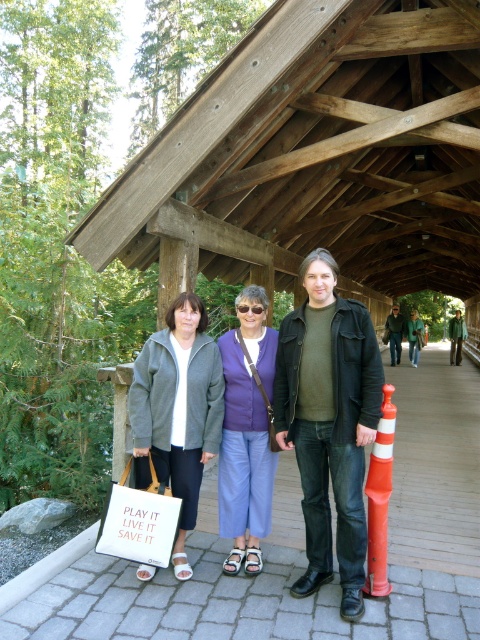
You are a fashion designer observing the two outfits at center. Which clothing item, the matte gray jacket at center or the matte purple sweater at center, is positioned higher on the person?

The matte gray jacket at center is positioned higher than the matte purple sweater at center.

You are a photographer trying to capture a photo of the matte gray jacket at center and the matte purple sweater at center. Which one should you focus on first if you want to include both in the frame without moving the camera?

The matte gray jacket at center is positioned on the left side of the matte purple sweater at center, so you should focus on the matte gray jacket at center first to ensure both are in the frame without moving the camera.